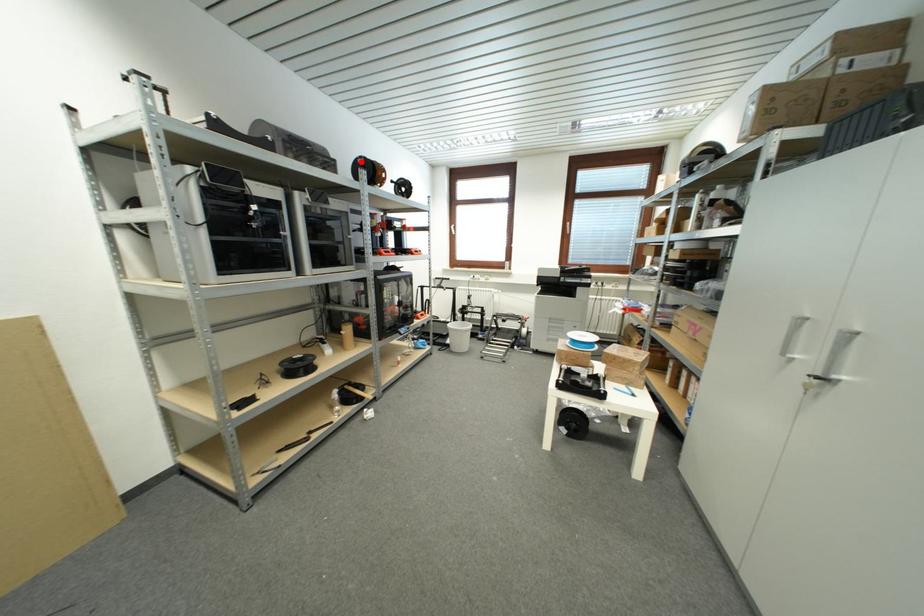
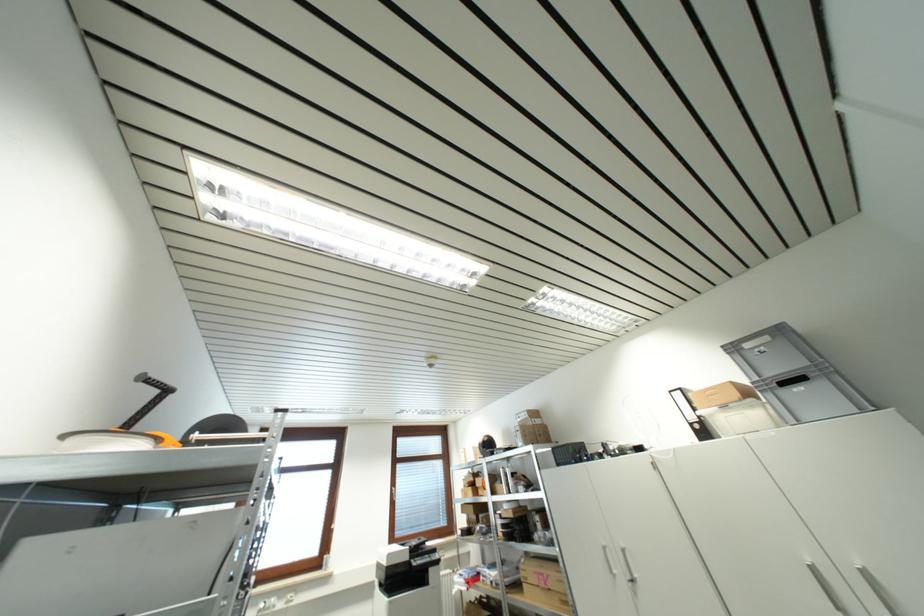
Question: I am providing you with two images of the same scene from different viewpoints. A red point is marked on the first image. At the location where the point appears in image 1, is it still visible in image 2?

Choices:
 (A) Yes
 (B) No

Answer: (B)